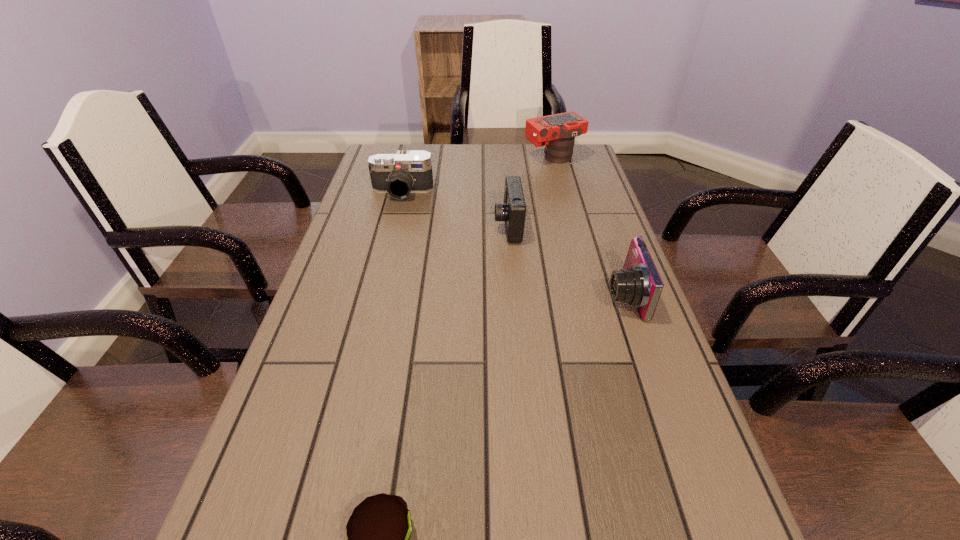
Locate an element on the screen. This screenshot has height=540, width=960. the farthest camera is located at coordinates (558, 131).

I want to click on the tallest object, so click(558, 131).

At what (x,y) coordinates should I click in order to perform the action: click on the second nearest camera. Please return your answer as a coordinate pair (x, y). Looking at the image, I should click on (513, 210).

Find the location of a particular element. This screenshot has height=540, width=960. the second camera from left to right is located at coordinates (513, 210).

Find the location of a particular element. This screenshot has height=540, width=960. the leftmost camera is located at coordinates (408, 171).

Where is `the fourth nearest object`? This screenshot has width=960, height=540. the fourth nearest object is located at coordinates (408, 171).

At what (x,y) coordinates should I click in order to perform the action: click on the fourth farthest object. Please return your answer as a coordinate pair (x, y). The image size is (960, 540). Looking at the image, I should click on (639, 284).

Image resolution: width=960 pixels, height=540 pixels. What are the coordinates of `free space located 0.390m on the left of the tallest object` in the screenshot? It's located at (411, 158).

Where is `vacant region located 0.230m on the front-facing side of the second camera from left to right`? vacant region located 0.230m on the front-facing side of the second camera from left to right is located at coordinates (412, 226).

Where is `vacant space situated 0.090m on the front-facing side of the second camera from left to right`? vacant space situated 0.090m on the front-facing side of the second camera from left to right is located at coordinates (462, 226).